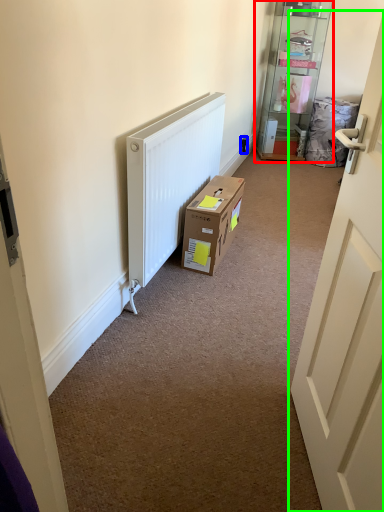
Question: Estimate the real-world distances between objects in this image. Which object is farther from shelf (highlighted by a red box), electric outlet (highlighted by a blue box) or door (highlighted by a green box)?

Choices:
 (A) electric outlet
 (B) door

Answer: (B)